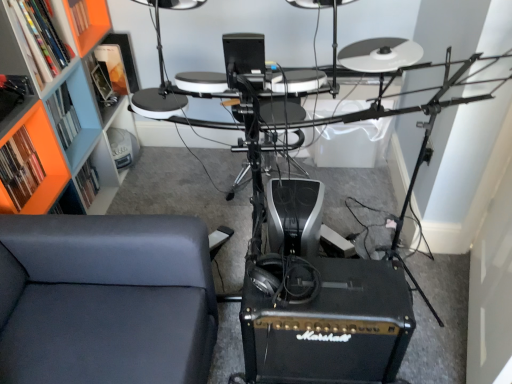
This screenshot has width=512, height=384. I want to click on orange matte bookshelf at upper left, the first shelf ordered from the bottom, so click(x=40, y=161).

Image resolution: width=512 pixels, height=384 pixels. What do you see at coordinates (326, 322) in the screenshot?
I see `black matte marshall amplifier at lower center` at bounding box center [326, 322].

Locate an element on the screen. The width and height of the screenshot is (512, 384). black leather armchair at center is located at coordinates (249, 132).

Where is `orange matte bookshelf at upper left, the third shelf positioned from the top`? This screenshot has width=512, height=384. orange matte bookshelf at upper left, the third shelf positioned from the top is located at coordinates (13, 67).

Find the location of a particular element. suede-like gray chair at lower left is located at coordinates coord(105,299).

Find the location of a particular element. The width and height of the screenshot is (512, 384). orange matte bookshelf at upper left, the first shelf ordered from the bottom is located at coordinates (40, 161).

From a real-world perspective, which is physically above, orange plastic shelf at upper left, placed as the 4th shelf when sorted from bottom to top, or black leather armchair at center?

orange plastic shelf at upper left, placed as the 4th shelf when sorted from bottom to top.

Considering the relative sizes of orange plastic shelf at upper left, which is counted as the 1th shelf, starting from the top, and black leather armchair at center in the image provided, is orange plastic shelf at upper left, which is counted as the 1th shelf, starting from the top, wider than black leather armchair at center?

No.

Based on the photo, is orange plastic shelf at upper left, placed as the 4th shelf when sorted from bottom to top, with black leather armchair at center?

orange plastic shelf at upper left, placed as the 4th shelf when sorted from bottom to top, is not next to black leather armchair at center, and they're not touching.

Considering their positions, is orange plastic shelf at upper left, placed as the 4th shelf when sorted from bottom to top, located in front of or behind black leather armchair at center?

Visually, orange plastic shelf at upper left, placed as the 4th shelf when sorted from bottom to top, is located in front of black leather armchair at center.

Between orange matte bookshelf at upper left, the third shelf positioned from the top, and black leather armchair at center, which one is positioned behind?

black leather armchair at center is further from the camera.

Does point (13, 42) appear closer or farther from the camera than point (302, 118)?

Point (13, 42) is positioned closer to the camera compared to point (302, 118).

Between orange matte bookshelf at upper left, the third shelf positioned from the top, and black leather armchair at center, which one has smaller size?

orange matte bookshelf at upper left, the third shelf positioned from the top.

The height and width of the screenshot is (384, 512). What are the coordinates of `armchair below the orange matte bookshelf at upper left, the second shelf from the bottom (from the image's perspective)` in the screenshot? It's located at (249, 132).

From the image's perspective, which one is positioned higher, black leather armchair at center or orange plastic shelf at upper left, placed as the 4th shelf when sorted from bottom to top?

orange plastic shelf at upper left, placed as the 4th shelf when sorted from bottom to top, appears higher in the image.

Is black leather armchair at center looking in the opposite direction of orange plastic shelf at upper left, which is counted as the 1th shelf, starting from the top?

That's not correct — black leather armchair at center is not looking away from orange plastic shelf at upper left, which is counted as the 1th shelf, starting from the top.

Which is more to the left, black leather armchair at center or orange plastic shelf at upper left, which is counted as the 1th shelf, starting from the top?

orange plastic shelf at upper left, which is counted as the 1th shelf, starting from the top, is more to the left.

Considering the sizes of black leather armchair at center and orange plastic shelf at upper left, which is counted as the 1th shelf, starting from the top, in the image, is black leather armchair at center taller or shorter than orange plastic shelf at upper left, which is counted as the 1th shelf, starting from the top,?

Considering their sizes, black leather armchair at center has more height than orange plastic shelf at upper left, which is counted as the 1th shelf, starting from the top.

Does suede-like gray chair at lower left have a greater height compared to orange matte bookshelf at upper left, the 4th shelf when ordered from top to bottom?

Yes, suede-like gray chair at lower left is taller than orange matte bookshelf at upper left, the 4th shelf when ordered from top to bottom.

From a real-world perspective, is suede-like gray chair at lower left physically located above or below orange matte bookshelf at upper left, the first shelf ordered from the bottom?

Clearly, from a real-world perspective, suede-like gray chair at lower left is below orange matte bookshelf at upper left, the first shelf ordered from the bottom.

Which object is closer to the camera, suede-like gray chair at lower left or orange matte bookshelf at upper left, the first shelf ordered from the bottom?

suede-like gray chair at lower left is more forward.

Is suede-like gray chair at lower left bigger than orange matte bookshelf at upper left, the first shelf ordered from the bottom?

Yes.

Considering the positions of objects black leather armchair at center and black matte marshall amplifier at lower center in the image provided, who is more to the right, black leather armchair at center or black matte marshall amplifier at lower center?

Positioned to the right is black matte marshall amplifier at lower center.

Between point (260, 117) and point (254, 347), which one is positioned behind?

Positioned behind is point (260, 117).

Is black leather armchair at center positioned beyond the bounds of black matte marshall amplifier at lower center?

Indeed, black leather armchair at center is completely outside black matte marshall amplifier at lower center.

From the image's perspective, starting from the suede-like gray chair at lower left, which shelf is the 1st one above? Please provide its 2D coordinates.

[(40, 161)]

Between orange matte bookshelf at upper left, the first shelf ordered from the bottom, and suede-like gray chair at lower left, which one appears on the right side from the viewer's perspective?

suede-like gray chair at lower left.

In the scene shown: Considering the relative positions of orange matte bookshelf at upper left, the 4th shelf when ordered from top to bottom, and suede-like gray chair at lower left in the image provided, is orange matte bookshelf at upper left, the 4th shelf when ordered from top to bottom, behind suede-like gray chair at lower left?

Yes, orange matte bookshelf at upper left, the 4th shelf when ordered from top to bottom, is further from the viewer.

Is orange matte bookshelf at upper left, the 4th shelf when ordered from top to bottom, taller than suede-like gray chair at lower left?

In fact, orange matte bookshelf at upper left, the 4th shelf when ordered from top to bottom, may be shorter than suede-like gray chair at lower left.

From a real-world perspective, is orange matte bookshelf at upper left, the third shelf positioned from the top, on orange plastic shelf at left, acting as the second shelf starting from the top?

Yes, from a real-world perspective, orange matte bookshelf at upper left, the third shelf positioned from the top, is above orange plastic shelf at left, acting as the second shelf starting from the top.

Which is less distant, (3, 22) or (82, 118)?

The point (3, 22) is closer.

From the image's perspective, is orange matte bookshelf at upper left, the third shelf positioned from the top, on top of orange plastic shelf at left, acting as the second shelf starting from the top?

No, from the image's perspective, orange matte bookshelf at upper left, the third shelf positioned from the top, is not over orange plastic shelf at left, acting as the second shelf starting from the top.

Starting from the black leather armchair at center, which shelf is the 2nd one in front? Please provide its 2D coordinates.

[(41, 38)]

Where is `the 1st shelf above the black leather armchair at center (from the image's perspective)`? The height and width of the screenshot is (384, 512). the 1st shelf above the black leather armchair at center (from the image's perspective) is located at coordinates (13, 67).

Looking at this image, which object lies further to the anchor point suede-like gray chair at lower left, orange plastic shelf at left, the third shelf positioned from the bottom, or orange plastic shelf at upper left, which is counted as the 1th shelf, starting from the top?

The object further to suede-like gray chair at lower left is orange plastic shelf at upper left, which is counted as the 1th shelf, starting from the top.

Estimate the real-world distances between objects in this image. Which object is closer to orange plastic shelf at upper left, placed as the 4th shelf when sorted from bottom to top, orange matte bookshelf at upper left, the first shelf ordered from the bottom, or suede-like gray chair at lower left?

orange matte bookshelf at upper left, the first shelf ordered from the bottom, is closer to orange plastic shelf at upper left, placed as the 4th shelf when sorted from bottom to top.

When comparing their distances from suede-like gray chair at lower left, does orange plastic shelf at upper left, which is counted as the 1th shelf, starting from the top, or orange matte bookshelf at upper left, the third shelf positioned from the top, seem further?

Among the two, orange plastic shelf at upper left, which is counted as the 1th shelf, starting from the top, is located further to suede-like gray chair at lower left.

Based on their spatial positions, is orange matte bookshelf at upper left, the first shelf ordered from the bottom, or black leather armchair at center further from orange plastic shelf at upper left, placed as the 4th shelf when sorted from bottom to top?

Based on the image, black leather armchair at center appears to be further to orange plastic shelf at upper left, placed as the 4th shelf when sorted from bottom to top.

When comparing their distances from orange matte bookshelf at upper left, the 4th shelf when ordered from top to bottom, does orange matte bookshelf at upper left, the third shelf positioned from the top, or orange plastic shelf at left, acting as the second shelf starting from the top, seem further?

Based on the image, orange matte bookshelf at upper left, the third shelf positioned from the top, appears to be further to orange matte bookshelf at upper left, the 4th shelf when ordered from top to bottom.

Which object lies further to the anchor point orange plastic shelf at left, the third shelf positioned from the bottom, orange matte bookshelf at upper left, the first shelf ordered from the bottom, or orange plastic shelf at upper left, which is counted as the 1th shelf, starting from the top?

The object further to orange plastic shelf at left, the third shelf positioned from the bottom, is orange plastic shelf at upper left, which is counted as the 1th shelf, starting from the top.

Looking at the image, which one is located further to orange matte bookshelf at upper left, the third shelf positioned from the top, orange plastic shelf at left, the third shelf positioned from the bottom, or suede-like gray chair at lower left?

suede-like gray chair at lower left.

From the image, which object appears to be farther from suede-like gray chair at lower left, orange plastic shelf at upper left, placed as the 4th shelf when sorted from bottom to top, or black matte marshall amplifier at lower center?

orange plastic shelf at upper left, placed as the 4th shelf when sorted from bottom to top, lies further to suede-like gray chair at lower left than the other object.

At what (x,y) coordinates should I click in order to perform the action: click on furniture located between orange matte bookshelf at upper left, the third shelf positioned from the top, and black matte marshall amplifier at lower center in the left-right direction. Please return your answer as a coordinate pair (x, y). Image resolution: width=512 pixels, height=384 pixels. Looking at the image, I should click on (105, 299).

At what (x,y) coordinates should I click in order to perform the action: click on shelf between orange matte bookshelf at upper left, the third shelf positioned from the top, and black leather armchair at center, in the horizontal direction. Please return your answer as a coordinate pair (x, y). Looking at the image, I should click on (41, 38).

Where is `armchair between orange matte bookshelf at upper left, the 4th shelf when ordered from top to bottom, and black matte marshall amplifier at lower center, in the horizontal direction`? This screenshot has height=384, width=512. armchair between orange matte bookshelf at upper left, the 4th shelf when ordered from top to bottom, and black matte marshall amplifier at lower center, in the horizontal direction is located at coordinates (249, 132).

The image size is (512, 384). I want to click on armchair between orange plastic shelf at left, the third shelf positioned from the bottom, and black matte marshall amplifier at lower center, so tap(249, 132).